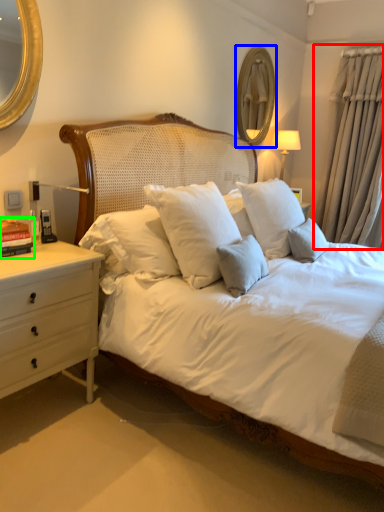
Question: Considering the real-world distances, which object is closest to curtain (highlighted by a red box)? mirror (highlighted by a blue box) or book (highlighted by a green box).

Choices:
 (A) mirror
 (B) book

Answer: (A)